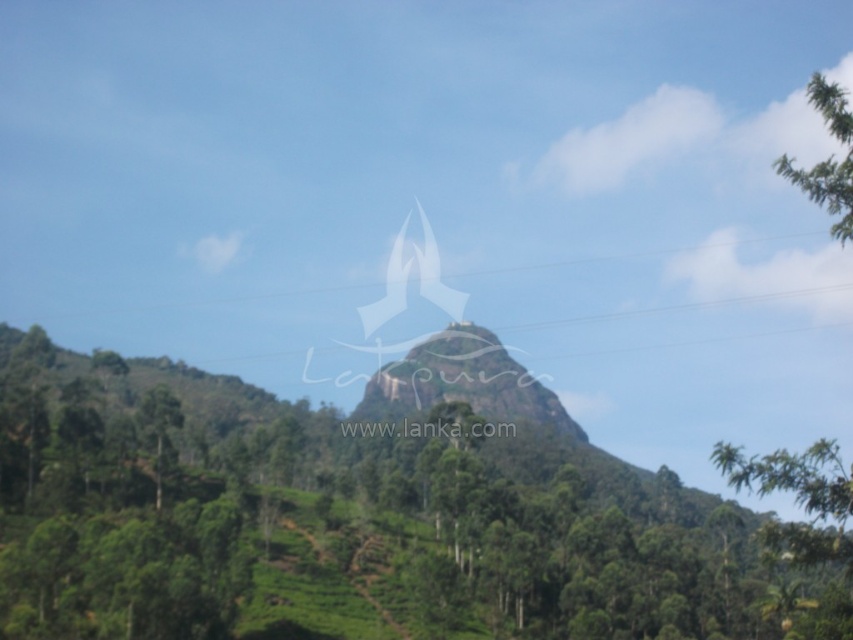
Can you confirm if green leafy tree at center is smaller than green leafy tree at upper right?

Actually, green leafy tree at center might be larger than green leafy tree at upper right.

Is point (422, 378) more distant than point (819, 172)?

Yes, point (422, 378) is behind point (819, 172).

Consider the image. Who is more forward, (349, 547) or (834, 86)?

Point (834, 86) is in front.

Where is `green leafy tree at center`? The width and height of the screenshot is (853, 640). green leafy tree at center is located at coordinates (368, 508).